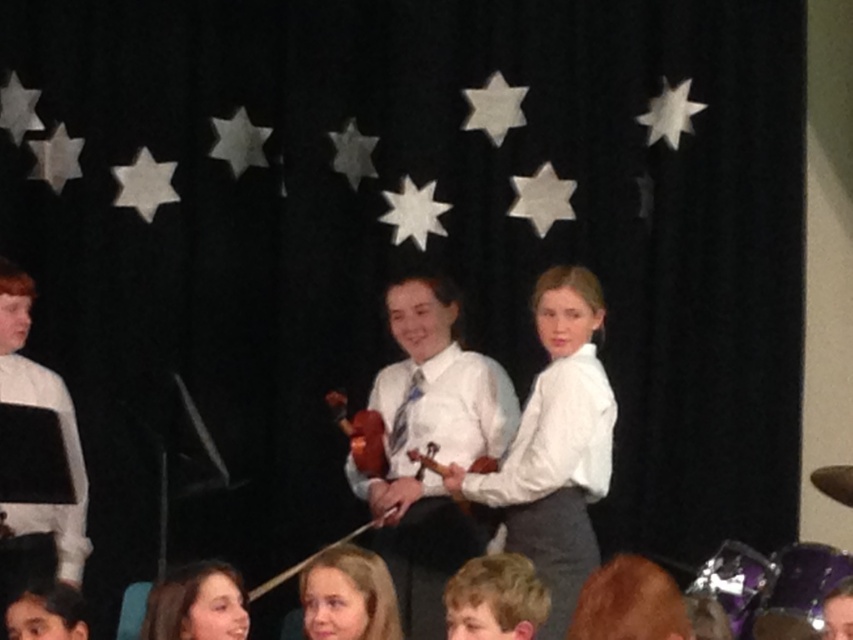
You are a photographer at the back of the room. You need to take a photo of both the smooth blonde hair at lower center and the smooth brown hair at lower left. Which person should you pan your camera to the right to capture?

You should pan your camera to the right to capture the smooth blonde hair at lower center because it is positioned on the right side of the smooth brown hair at lower left.

You are sitting in the audience at the event and notice two performers on stage wearing white tops. The white glossy shirt at center and the white satin blouse at center. Which one is positioned to the left?

The white glossy shirt at center is positioned to the left of the white satin blouse at center.

You are a photographer positioned at the back of the stage. You want to take a photo of both the smooth blonde hair at lower center and the smooth brown hair at lower left in the same frame. Given that your camera has a maximum focus range of 30 centimeters, will you be able to capture both subjects clearly in one shot?

The smooth blonde hair at lower center is 33.74 centimeters away from the smooth brown hair at lower left. Since the distance between them exceeds the camera maximum focus range of 30 centimeters, you won not be able to capture both subjects clearly in one shot.